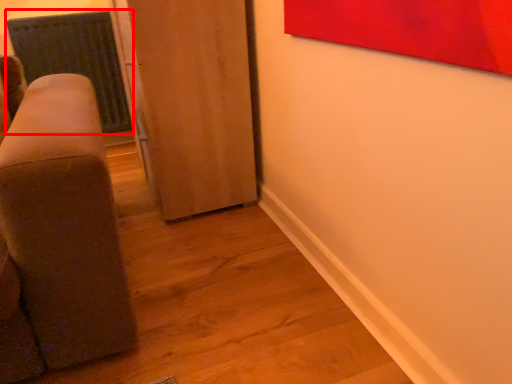
Question: From the image's perspective, where is radiator (annotated by the red box) located in relation to door in the image?

Choices:
 (A) above
 (B) below

Answer: (A)